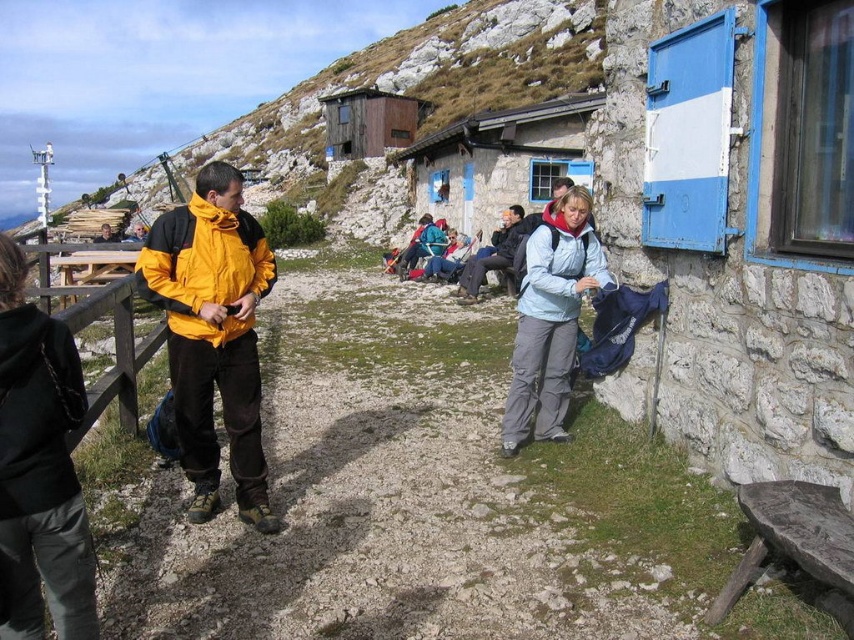
You are a hiker trying to reach the blue stone hut at right from your current position near the light blue jacket at center. Considering the rugged terrain, can you estimate how far you need to walk to get there?

The blue stone hut at right is 8.55 meters away from the light blue jacket at center, so you need to walk approximately 8.55 meters to reach it.

You are a hiker who needs to determine the relative sizes of objects in the scene. Based on the image, which object is smaller between the yellow matte jacket at left and the stone cabin at center?

The yellow matte jacket at left is smaller than the stone cabin at center according to the description.